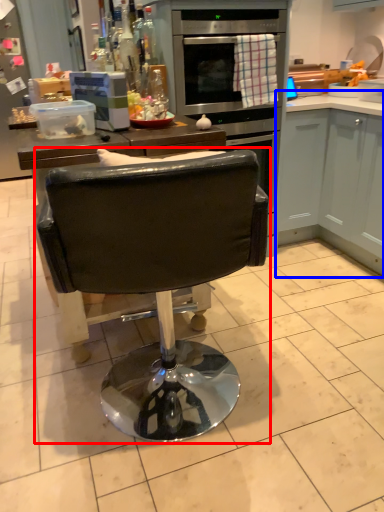
Question: Which object is closer to the camera taking this photo, chair (highlighted by a red box) or cabinetry (highlighted by a blue box)?

Choices:
 (A) chair
 (B) cabinetry

Answer: (A)